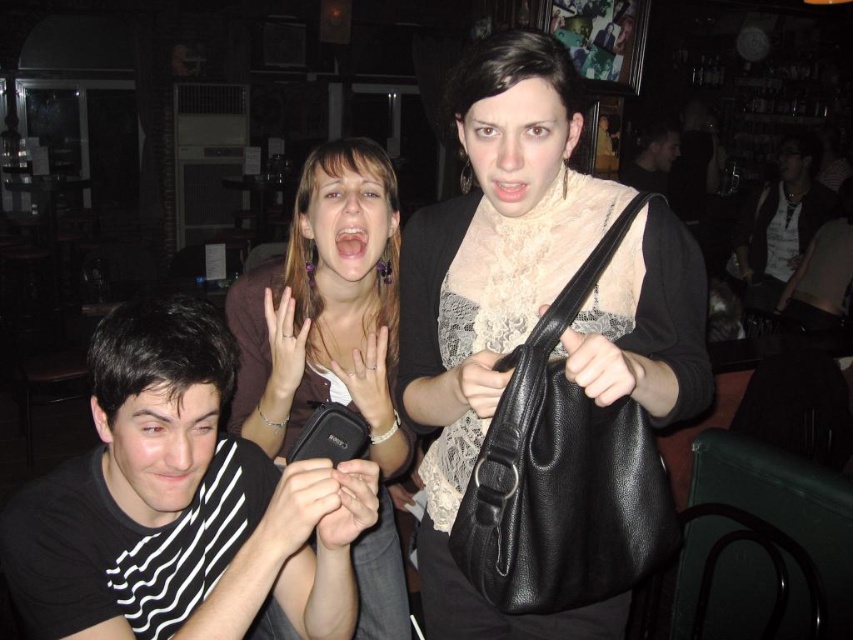
You are standing in the bar and want to place a black leather handbag exactly at the center of the room. Is the point at coordinates [494,298] the correct location for this?

Yes, the black leather handbag at center is located exactly at point [494,298], so placing it there would be correct.

You are standing in the bar and want to place a small drink coaster on the table closest to the dark brown leather jacket at right. Where should you place it to ensure it is directly in front of the jacket?

Place the coaster at point (781,224) directly in front of the dark brown leather jacket at right.

You are a photographer trying to capture a candid shot of the scene. You have a camera with a 50mm lens. The dark brown leather jacket at right and the matte black bag at upper center are both in your frame. Which object should you focus on if you want to ensure both are in focus simultaneously?

The dark brown leather jacket at right is bigger than the matte black bag at upper center, so focusing on the dark brown leather jacket at right will help ensure both are in focus because it is larger and closer to the camera.